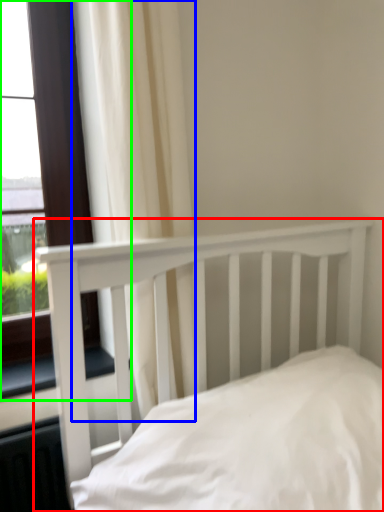
Question: Which object is positioned farthest from bed (highlighted by a red box)? Select from curtain (highlighted by a blue box) and window (highlighted by a green box).

Choices:
 (A) curtain
 (B) window

Answer: (B)